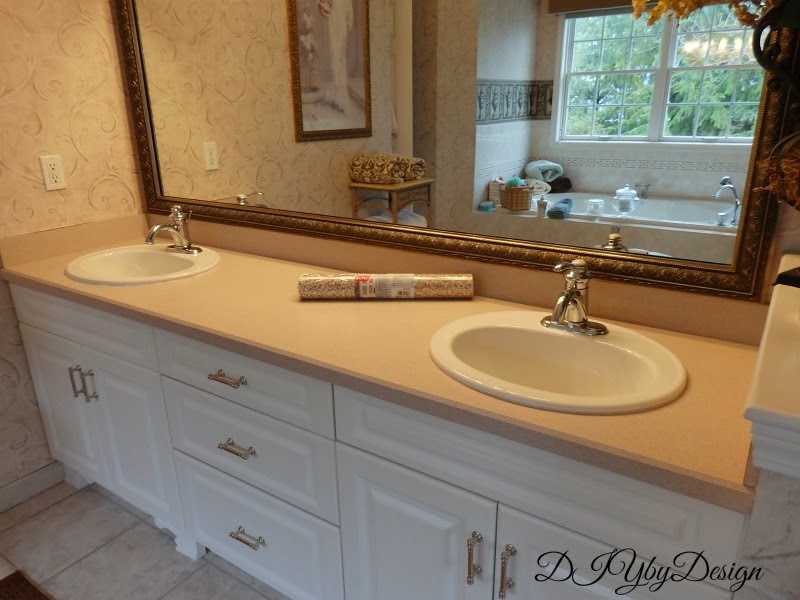
Identify the location of tub. The width and height of the screenshot is (800, 600). (669, 208).